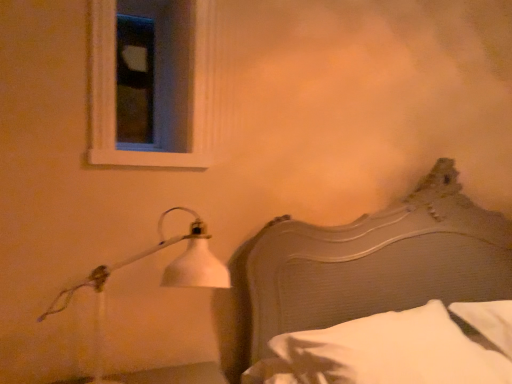
Question: Is white matte lamp at left outside of wooden headboard at right?

Choices:
 (A) yes
 (B) no

Answer: (A)

Question: From a real-world perspective, is white matte lamp at left beneath wooden headboard at right?

Choices:
 (A) no
 (B) yes

Answer: (B)

Question: Is white matte lamp at left next to wooden headboard at right?

Choices:
 (A) yes
 (B) no

Answer: (B)

Question: Is white matte lamp at left at the left side of wooden headboard at right?

Choices:
 (A) no
 (B) yes

Answer: (B)

Question: Is wooden headboard at right completely or partially inside white matte lamp at left?

Choices:
 (A) no
 (B) yes

Answer: (A)

Question: From the image's perspective, is white matte lamp at left on top of wooden headboard at right?

Choices:
 (A) no
 (B) yes

Answer: (A)

Question: Is wooden headboard at right positioned far away from white soft pillow at lower right?

Choices:
 (A) yes
 (B) no

Answer: (B)

Question: Is white soft pillow at lower right at the back of wooden headboard at right?

Choices:
 (A) yes
 (B) no

Answer: (A)

Question: From a real-world perspective, is wooden headboard at right under white soft pillow at lower right?

Choices:
 (A) yes
 (B) no

Answer: (B)

Question: From the image's perspective, is wooden headboard at right on white soft pillow at lower right?

Choices:
 (A) no
 (B) yes

Answer: (B)

Question: Does wooden headboard at right have a smaller size compared to white soft pillow at lower right?

Choices:
 (A) no
 (B) yes

Answer: (A)

Question: Can you confirm if wooden headboard at right is wider than white soft pillow at lower right?

Choices:
 (A) no
 (B) yes

Answer: (B)

Question: Can you confirm if white matte lamp at left is shorter than white wood frame at upper left?

Choices:
 (A) yes
 (B) no

Answer: (B)